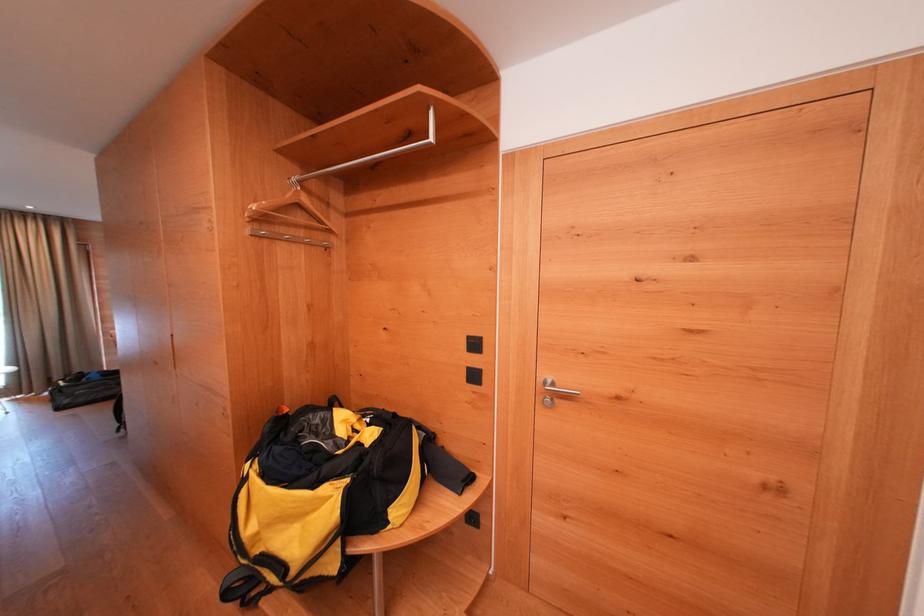
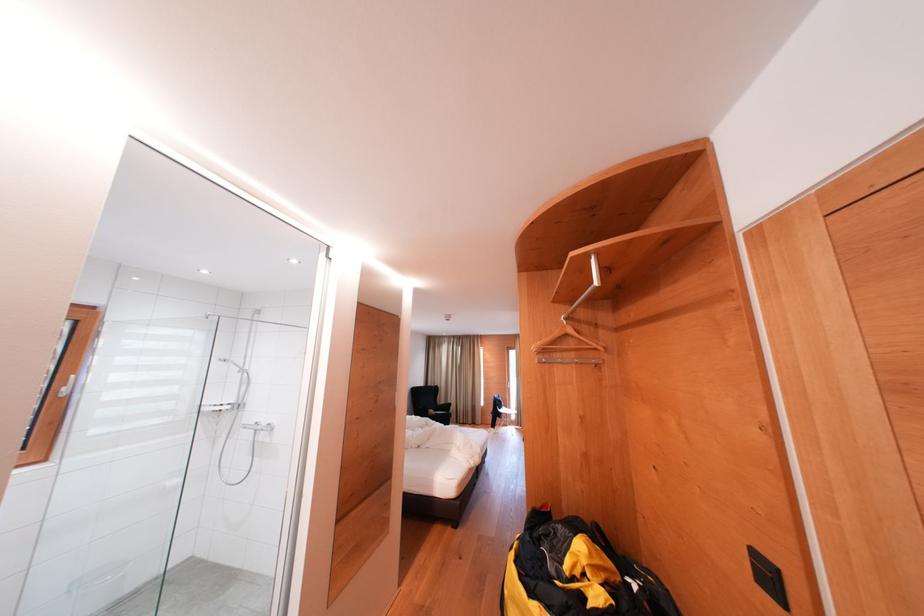
Locate, in the second image, the point that corresponds to point (308, 237) in the first image.

(579, 359)